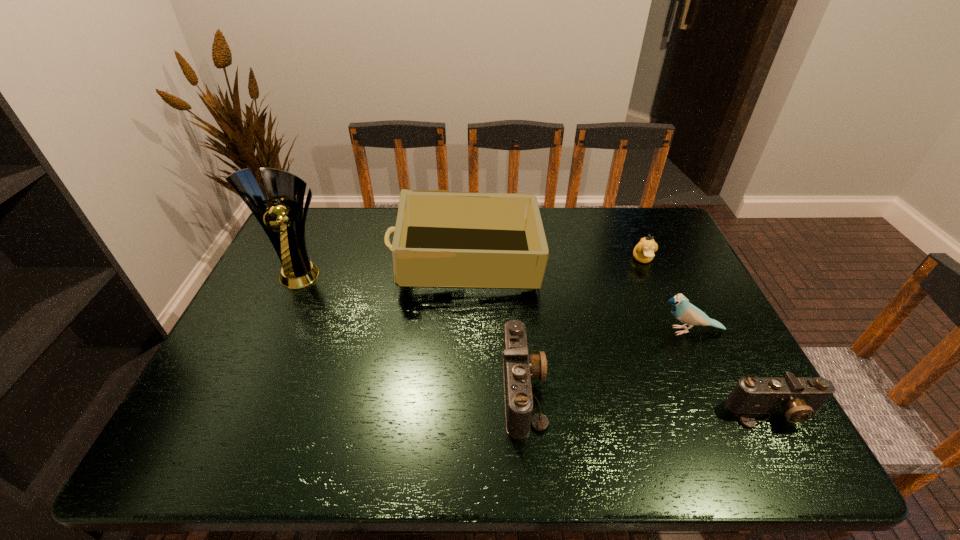
Identify the location of object that is at the far right corner. The height and width of the screenshot is (540, 960). (643, 252).

Find the location of a particular element. The width and height of the screenshot is (960, 540). object present at the near right corner is located at coordinates (799, 399).

In the image, there is a desktop. Find the location of `free space at the far edge`. free space at the far edge is located at coordinates (362, 238).

In the image, there is a desktop. At what (x,y) coordinates should I click in order to perform the action: click on vacant area at the near edge. Please return your answer as a coordinate pair (x, y). The height and width of the screenshot is (540, 960). Looking at the image, I should click on (343, 397).

In the image, there is a desktop. Where is `vacant space at the left edge`? This screenshot has height=540, width=960. vacant space at the left edge is located at coordinates (269, 375).

Locate an element on the screen. The width and height of the screenshot is (960, 540). vacant space at the right edge of the desktop is located at coordinates (665, 314).

Locate an element on the screen. The image size is (960, 540). vacant area at the far left corner of the desktop is located at coordinates (333, 233).

At what (x,y) coordinates should I click in order to perform the action: click on vacant area at the far right corner of the desktop. Please return your answer as a coordinate pair (x, y). The height and width of the screenshot is (540, 960). Looking at the image, I should click on (676, 235).

Locate an element on the screen. The width and height of the screenshot is (960, 540). unoccupied position between the leftmost object and the third nearest object is located at coordinates (495, 301).

Image resolution: width=960 pixels, height=540 pixels. Identify the location of free space between the bird and the right camera. [732, 372].